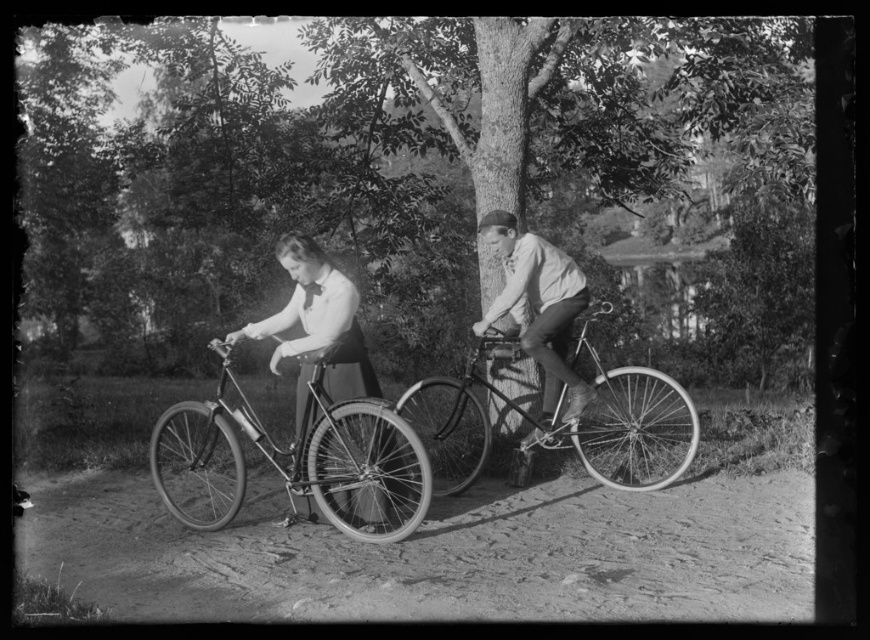
You are standing at the point marked as point [318,321]. Looking around, you see a matte black bicycle at center. Where is the matte black bicycle at center located relative to your current position?

The matte black bicycle at center is located at the point you are currently standing at, point [318,321].